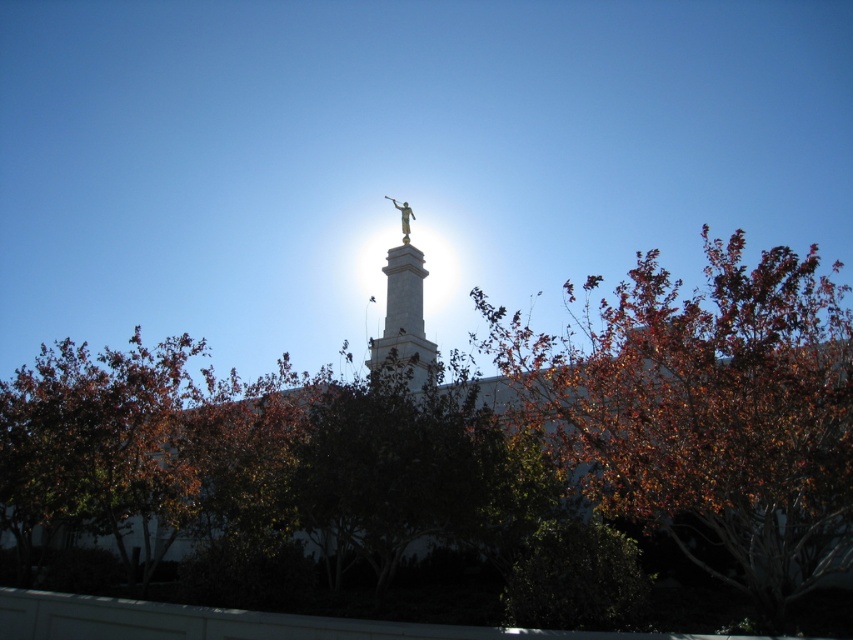
Question: Among these objects, which one is farthest from the camera?

Choices:
 (A) gold metallic statue at upper center
 (B) gold polished statue at center

Answer: (A)

Question: Based on their relative distances, which object is nearer to the autumn leaves at upper center?

Choices:
 (A) gold polished statue at center
 (B) gold metallic statue at upper center

Answer: (A)

Question: Can you confirm if autumn leaves at upper center is positioned to the left of gold polished statue at center?

Choices:
 (A) no
 (B) yes

Answer: (A)

Question: Is the position of autumn leaves at upper center less distant than that of gold metallic statue at upper center?

Choices:
 (A) no
 (B) yes

Answer: (B)

Question: Can you confirm if autumn leaves at upper center is positioned below gold polished statue at center?

Choices:
 (A) no
 (B) yes

Answer: (A)

Question: Which object is closer to the camera taking this photo?

Choices:
 (A) autumn leaves at upper center
 (B) gold polished statue at center
 (C) gold metallic statue at upper center

Answer: (A)